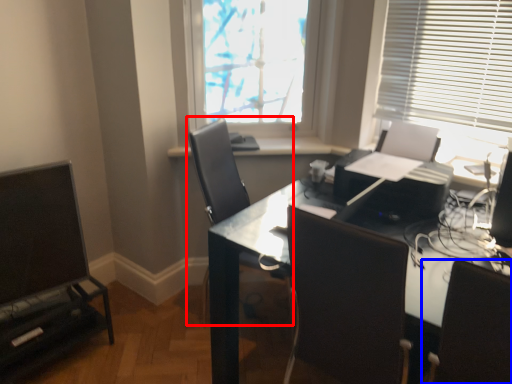
Question: Which point is closer to the camera, chair (highlighted by a red box) or chair (highlighted by a blue box)?

Choices:
 (A) chair
 (B) chair

Answer: (B)